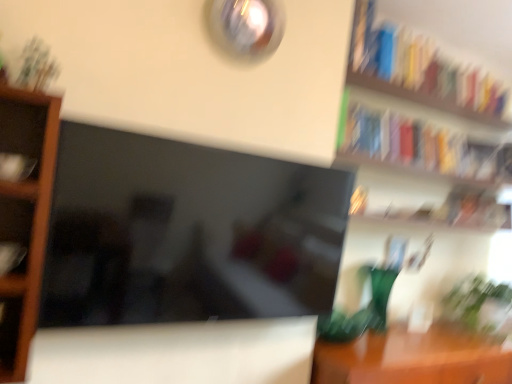
Question: Can you confirm if matte black book at left, which is counted as the first book, starting from the left, is bigger than brown wooden shelf at left?

Choices:
 (A) no
 (B) yes

Answer: (A)

Question: Can you confirm if matte black book at left, the second book viewed from the front, is positioned to the left of brown wooden shelf at left?

Choices:
 (A) yes
 (B) no

Answer: (A)

Question: Does matte black book at left, which is the third book from back to front, have a lesser width compared to brown wooden shelf at left?

Choices:
 (A) yes
 (B) no

Answer: (A)

Question: Is matte black book at left, the second book viewed from the front, surrounding brown wooden shelf at left?

Choices:
 (A) no
 (B) yes

Answer: (A)

Question: Is matte black book at left, which is the third book from back to front, positioned with its back to brown wooden shelf at left?

Choices:
 (A) no
 (B) yes

Answer: (B)

Question: Is brown wooden shelf at left inside or outside of green glass vase at right?

Choices:
 (A) outside
 (B) inside

Answer: (A)

Question: From the image's perspective, is brown wooden shelf at left located above or below green glass vase at right?

Choices:
 (A) below
 (B) above

Answer: (B)

Question: From their relative heights in the image, would you say brown wooden shelf at left is taller or shorter than green glass vase at right?

Choices:
 (A) short
 (B) tall

Answer: (B)

Question: Is brown wooden shelf at left to the left or to the right of green glass vase at right in the image?

Choices:
 (A) right
 (B) left

Answer: (B)

Question: Is point (437, 170) closer or farther from the camera than point (19, 258)?

Choices:
 (A) farther
 (B) closer

Answer: (A)

Question: Is hardcover book at upper right, the third book when ordered from left to right, bigger or smaller than matte black book at left, which is counted as the first book, starting from the left?

Choices:
 (A) small
 (B) big

Answer: (B)

Question: From the image's perspective, is hardcover book at upper right, arranged as the fourth book when viewed from the front, located above or below matte black book at left, the second book viewed from the front?

Choices:
 (A) below
 (B) above

Answer: (B)

Question: Considering the positions of hardcover book at upper right, arranged as the fourth book when viewed from the front, and matte black book at left, the 4th book positioned from the top, in the image, is hardcover book at upper right, arranged as the fourth book when viewed from the front, taller or shorter than matte black book at left, the 4th book positioned from the top,?

Choices:
 (A) tall
 (B) short

Answer: (A)

Question: In the image, is brown wooden table at lower right positioned in front of or behind hardcover book at upper right, which is counted as the fourth book, starting from the bottom?

Choices:
 (A) behind
 (B) front

Answer: (B)

Question: Does point [x=346, y=364] appear closer or farther from the camera than point [x=495, y=110]?

Choices:
 (A) closer
 (B) farther

Answer: (A)